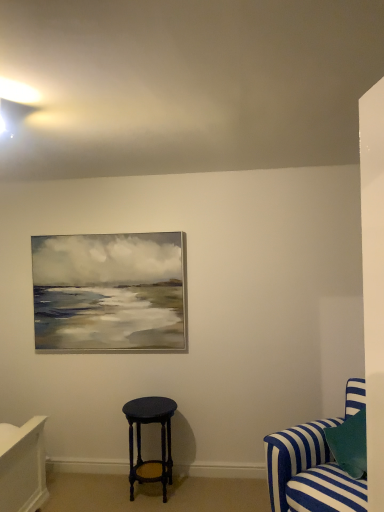
Question: From the image's perspective, is matte dark blue stool at center positioned above or below blue striped fabric couch at lower right?

Choices:
 (A) below
 (B) above

Answer: (A)

Question: Considering the positions of matte dark blue stool at center and blue striped fabric couch at lower right in the image, is matte dark blue stool at center wider or thinner than blue striped fabric couch at lower right?

Choices:
 (A) wide
 (B) thin

Answer: (B)

Question: Relative to blue striped fabric couch at lower right, is matte dark blue stool at center in front or behind?

Choices:
 (A) behind
 (B) front

Answer: (A)

Question: Based on their positions, is blue striped fabric couch at lower right located to the left or right of matte dark blue stool at center?

Choices:
 (A) right
 (B) left

Answer: (A)

Question: Considering the positions of blue striped fabric couch at lower right and matte dark blue stool at center in the image, is blue striped fabric couch at lower right taller or shorter than matte dark blue stool at center?

Choices:
 (A) tall
 (B) short

Answer: (A)

Question: From the image's perspective, is blue striped fabric couch at lower right located above or below matte dark blue stool at center?

Choices:
 (A) below
 (B) above

Answer: (B)

Question: In the image, is blue striped fabric couch at lower right positioned in front of or behind matte dark blue stool at center?

Choices:
 (A) behind
 (B) front

Answer: (B)